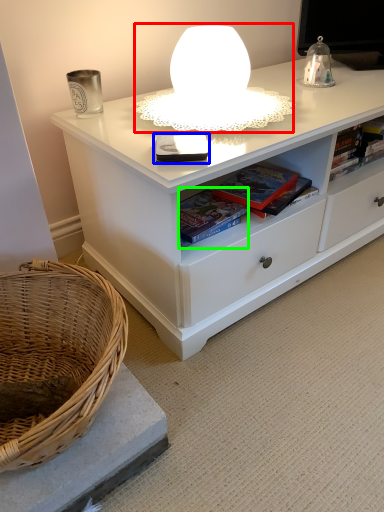
Question: Which is nearer to the table lamp (highlighted by a red box)? book (highlighted by a blue box) or book (highlighted by a green box).

Choices:
 (A) book
 (B) book

Answer: (A)